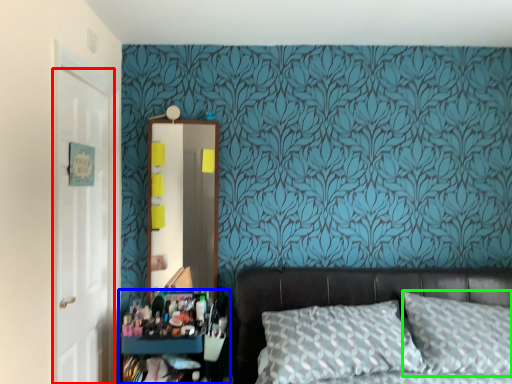
Question: Based on their relative distances, which object is nearer to door (highlighted by a red box)? Choose from dresser (highlighted by a blue box) and pillow (highlighted by a green box).

Choices:
 (A) dresser
 (B) pillow

Answer: (A)